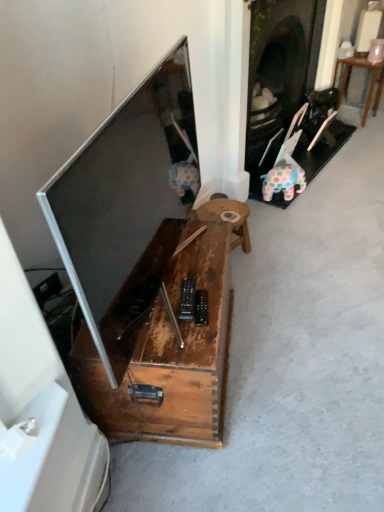
Question: Does wooden table at right, placed as the first table when sorted from top to bottom, have a larger size compared to rustic wood coffee table at center?

Choices:
 (A) yes
 (B) no

Answer: (B)

Question: Are wooden table at right, which is the second table in bottom-to-top order, and rustic wood coffee table at center far apart?

Choices:
 (A) no
 (B) yes

Answer: (B)

Question: Is wooden table at right, the first table in the back-to-front sequence, positioned before rustic wood coffee table at center?

Choices:
 (A) yes
 (B) no

Answer: (B)

Question: Considering the relative sizes of wooden table at right, the first table positioned from the right, and rustic wood coffee table at center in the image provided, is wooden table at right, the first table positioned from the right, taller than rustic wood coffee table at center?

Choices:
 (A) yes
 (B) no

Answer: (A)

Question: From a real-world perspective, does wooden table at right, the first table positioned from the right, sit lower than rustic wood coffee table at center?

Choices:
 (A) no
 (B) yes

Answer: (B)

Question: Is wooden table at right, which is the second table in bottom-to-top order, directly adjacent to rustic wood coffee table at center?

Choices:
 (A) yes
 (B) no

Answer: (B)

Question: Can you confirm if wooden table at right, placed as the first table when sorted from top to bottom, is wider than rustic wood table at center, which is counted as the second table, starting from the right?

Choices:
 (A) no
 (B) yes

Answer: (B)

Question: Is the position of wooden table at right, the second table from the front, more distant than that of rustic wood table at center, the 1th table when ordered from front to back?

Choices:
 (A) yes
 (B) no

Answer: (A)

Question: Considering the relative sizes of wooden table at right, the first table in the back-to-front sequence, and rustic wood table at center, the 2th table in the top-to-bottom sequence, in the image provided, is wooden table at right, the first table in the back-to-front sequence, taller than rustic wood table at center, the 2th table in the top-to-bottom sequence,?

Choices:
 (A) yes
 (B) no

Answer: (A)

Question: Does wooden table at right, the first table positioned from the right, have a larger size compared to rustic wood table at center, which is counted as the second table, starting from the right?

Choices:
 (A) yes
 (B) no

Answer: (A)

Question: Is wooden table at right, placed as the first table when sorted from top to bottom, placed right next to rustic wood table at center, the 1th table when ordered from front to back?

Choices:
 (A) no
 (B) yes

Answer: (A)

Question: From a real-world perspective, is wooden table at right, the first table positioned from the right, positioned under rustic wood table at center, which appears as the first table when viewed from the left, based on gravity?

Choices:
 (A) yes
 (B) no

Answer: (B)

Question: Is rustic wood table at center, the 2th table in the top-to-bottom sequence, positioned in front of rustic wood coffee table at center?

Choices:
 (A) yes
 (B) no

Answer: (B)